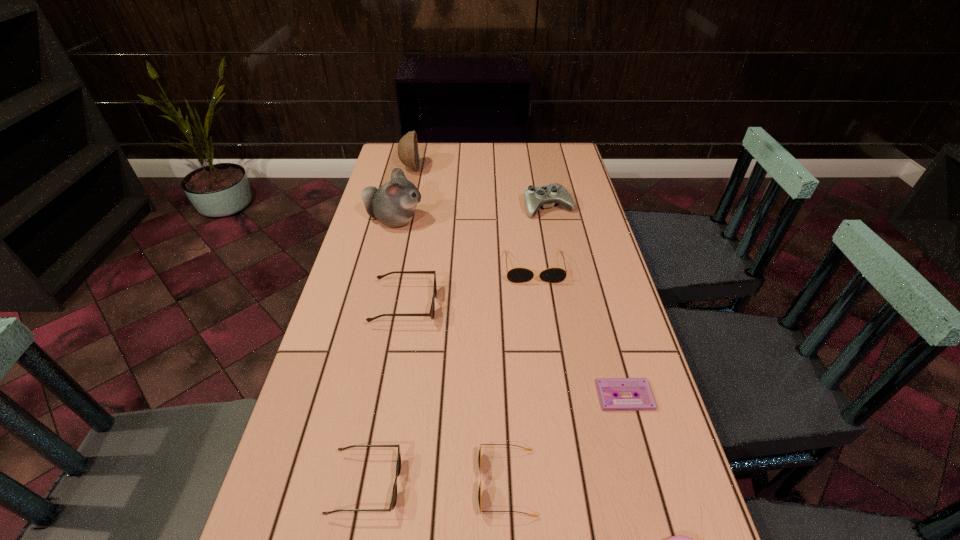
This screenshot has height=540, width=960. Find the location of `white hamster`. white hamster is located at coordinates (394, 203).

This screenshot has width=960, height=540. In order to click on bowl in this screenshot , I will do `click(408, 154)`.

Find the location of a particular element. Image resolution: width=960 pixels, height=540 pixels. the second tallest object is located at coordinates (408, 154).

At what (x,y) coordinates should I click in order to perform the action: click on the seventh shortest object. Please return your answer as a coordinate pair (x, y). Looking at the image, I should click on (546, 196).

I want to click on the farther black sunglasses, so click(x=516, y=275).

The width and height of the screenshot is (960, 540). Find the location of `the bigger brown sunglasses`. the bigger brown sunglasses is located at coordinates (431, 314).

In order to click on the nearer black sunglasses in this screenshot , I will do `click(479, 456)`.

The width and height of the screenshot is (960, 540). Find the location of `the smaller brown sunglasses`. the smaller brown sunglasses is located at coordinates (398, 465).

The height and width of the screenshot is (540, 960). What are the coordinates of `the sixth farthest object` in the screenshot? It's located at (607, 388).

Identify the location of videotape. (607, 388).